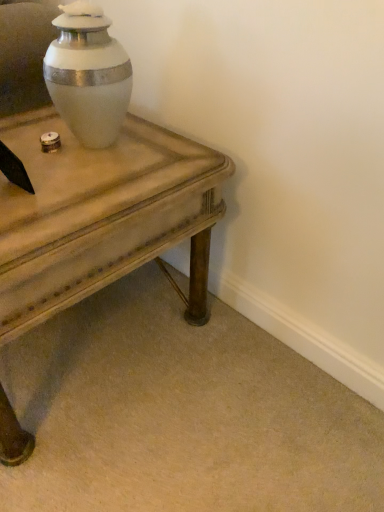
The image size is (384, 512). What are the coordinates of `vacant area situated below white glossy urn at upper center (from a real-world perspective)` in the screenshot? It's located at (89, 144).